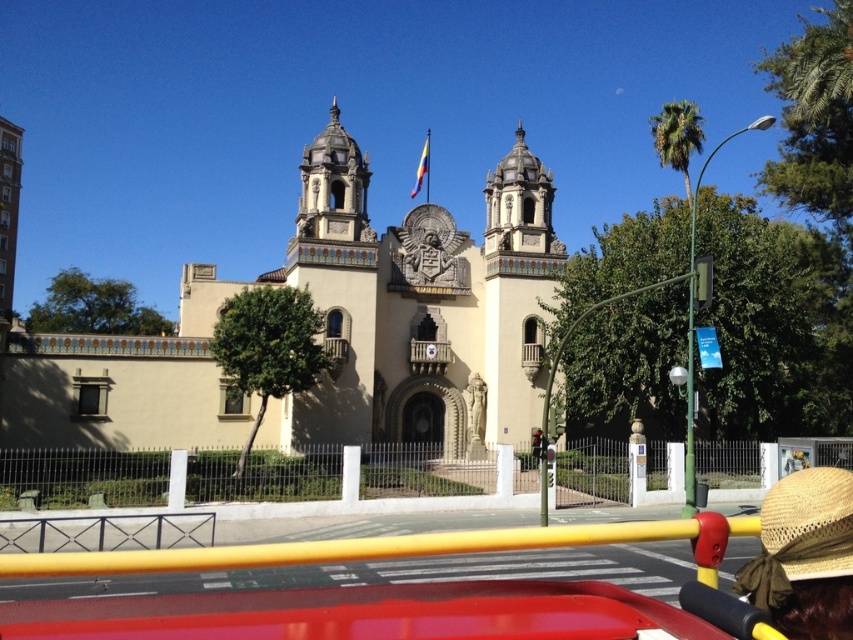
You are standing in front of a grand building with two towers. There is a point marked at coordinates (331,330). Which object is located at that point?

The beige stone church at center is located at point (331,330).